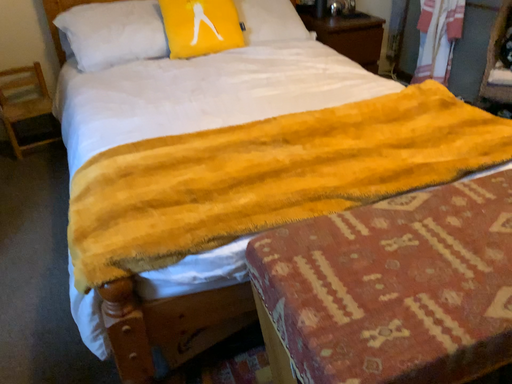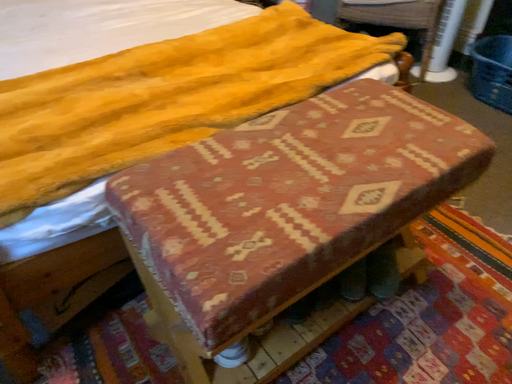
Question: Which way did the camera rotate in the video?

Choices:
 (A) rotated left
 (B) rotated right

Answer: (B)